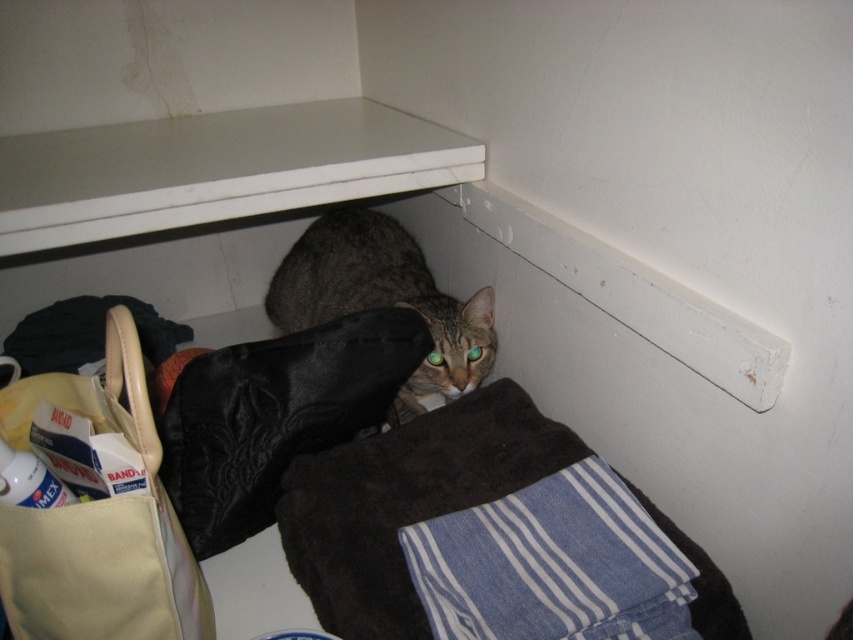
Is white matte shelf at upper center above yellow fabric bag at lower left?

Correct, white matte shelf at upper center is located above yellow fabric bag at lower left.

Is white matte shelf at upper center to the left of yellow fabric bag at lower left from the viewer's perspective?

Incorrect, white matte shelf at upper center is not on the left side of yellow fabric bag at lower left.

Which is behind, point (430, 145) or point (91, 561)?

Positioned behind is point (430, 145).

Where is `white matte shelf at upper center`? white matte shelf at upper center is located at coordinates (216, 170).

Which is more to the left, blue striped fabric at lower right or tabby fur cat at center?

Positioned to the left is tabby fur cat at center.

Is blue striped fabric at lower right behind tabby fur cat at center?

No, blue striped fabric at lower right is closer to the viewer.

Between point (589, 600) and point (364, 285), which one is positioned behind?

Positioned behind is point (364, 285).

In order to click on blue striped fabric at lower right in this screenshot , I will do [x=550, y=564].

Who is more forward, (137, 435) or (306, 253)?

Positioned in front is point (137, 435).

In the scene shown: Is yellow fabric bag at lower left to the right of tabby fur cat at center from the viewer's perspective?

No, yellow fabric bag at lower left is not to the right of tabby fur cat at center.

Identify the location of yellow fabric bag at lower left. tap(99, 522).